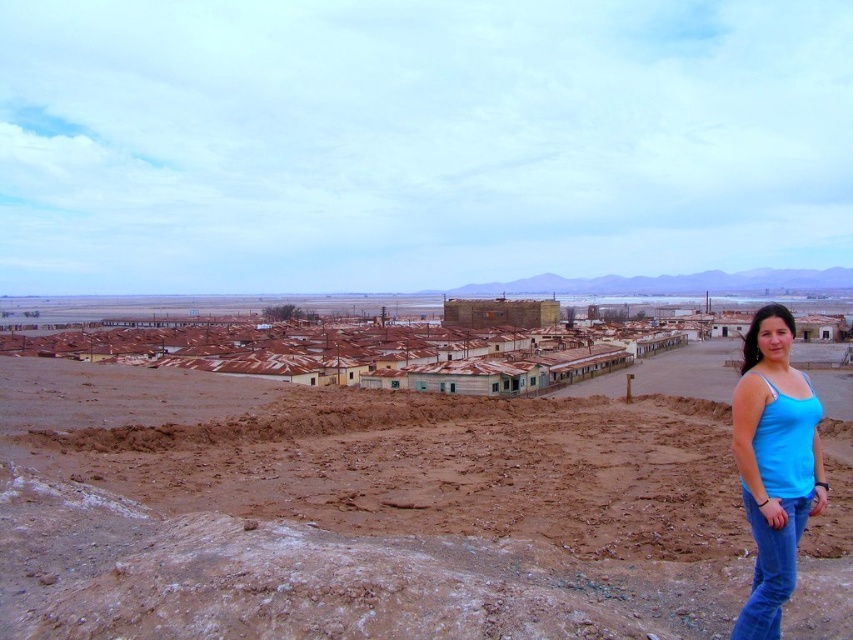
Can you confirm if brown sandy dirt field at lower center is positioned below blue cotton tank top at lower right?

Yes, brown sandy dirt field at lower center is below blue cotton tank top at lower right.

Is brown sandy dirt field at lower center closer to camera compared to blue cotton tank top at lower right?

Yes, it is in front of blue cotton tank top at lower right.

Is point (351, 637) less distant than point (820, 490)?

Yes, it is.

Locate an element on the screen. brown sandy dirt field at lower center is located at coordinates (357, 513).

Does brown sandy dirt field at lower center appear over rusty metal rooftops at center?

No, brown sandy dirt field at lower center is not above rusty metal rooftops at center.

Between point (337, 588) and point (120, 317), which one is positioned in front?

Positioned in front is point (337, 588).

Describe the element at coordinates (357, 513) in the screenshot. I see `brown sandy dirt field at lower center` at that location.

Image resolution: width=853 pixels, height=640 pixels. What are the coordinates of `brown sandy dirt field at lower center` in the screenshot? It's located at (357, 513).

From the picture: Does rusty metal rooftops at center appear on the right side of blue cotton tank top at lower right?

In fact, rusty metal rooftops at center is to the left of blue cotton tank top at lower right.

Is rusty metal rooftops at center shorter than blue cotton tank top at lower right?

Correct, rusty metal rooftops at center is not as tall as blue cotton tank top at lower right.

The height and width of the screenshot is (640, 853). Find the location of `rusty metal rooftops at center`. rusty metal rooftops at center is located at coordinates (339, 346).